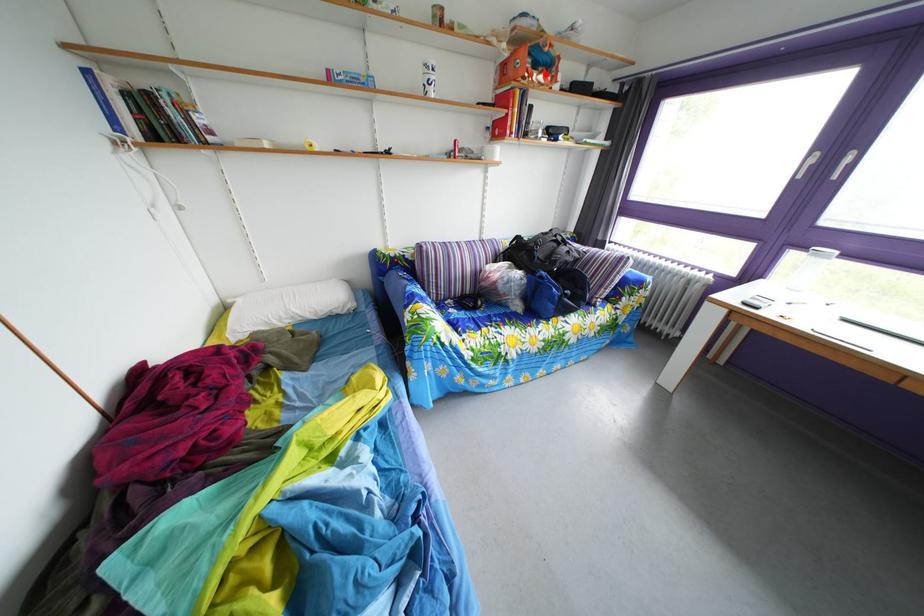
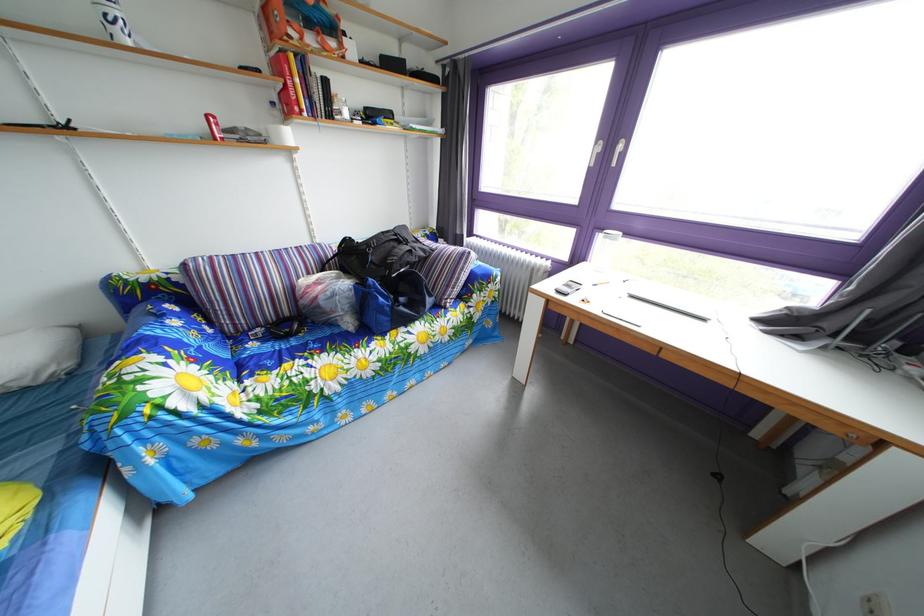
Locate, in the second image, the point that corresponds to the highlighted location in the first image.

(320, 33)